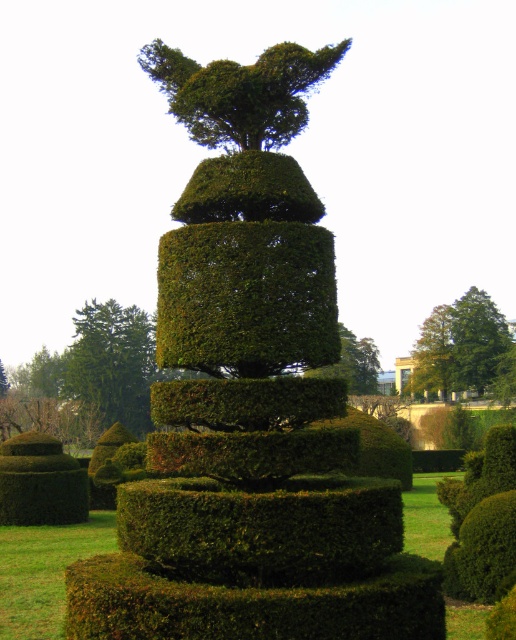
You are standing at the center of the garden and see a point marked at coordinates (459, 344). What object is located at that specific coordinate?

The point at coordinates (459, 344) is where the green leafy tree at upper center is located.